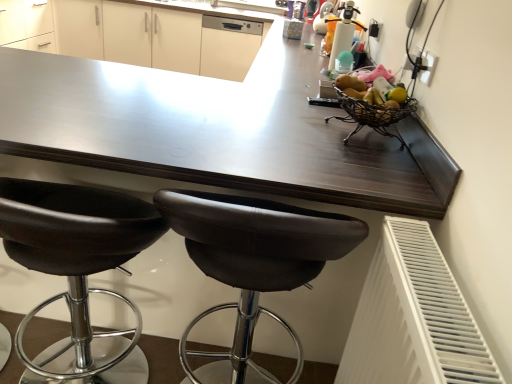
How much space does black leather stool at lower left, arranged as the first chair when viewed from the left, occupy vertically?

The height of black leather stool at lower left, arranged as the first chair when viewed from the left, is 84.64 centimeters.

Measure the distance between point (103, 55) and camera.

4.43 meters.

Where is `white matte cabinet at upper center`? The image size is (512, 384). white matte cabinet at upper center is located at coordinates (132, 35).

The width and height of the screenshot is (512, 384). What do you see at coordinates (428, 67) in the screenshot?
I see `black plastic socket at upper right` at bounding box center [428, 67].

Image resolution: width=512 pixels, height=384 pixels. In order to click on white glossy dishwasher at upper center in this screenshot , I will do click(228, 47).

I want to click on brown leather stool at center, which ranks as the first chair in right-to-left order, so click(253, 265).

I want to click on white plastic radiator at lower right, so click(413, 317).

Considering the relative positions of black plastic socket at upper right and black leather stool at lower left, the second chair viewed from the right, in the image provided, is black plastic socket at upper right behind black leather stool at lower left, the second chair viewed from the right,?

Yes, black plastic socket at upper right is further from the viewer.

I want to click on the 1st chair in front of the black plastic socket at upper right, starting your count from the anchor, so click(78, 271).

What's the angular difference between black plastic socket at upper right and black leather stool at lower left, arranged as the first chair when viewed from the left,'s facing directions?

The facing directions of black plastic socket at upper right and black leather stool at lower left, arranged as the first chair when viewed from the left, are 92.1 degrees apart.

How different are the orientations of white glossy dishwasher at upper center and white plastic radiator at lower right in degrees?

There is a 91-degree angle between the facing directions of white glossy dishwasher at upper center and white plastic radiator at lower right.

Considering the positions of points (256, 29) and (418, 301), is point (256, 29) closer to camera compared to point (418, 301)?

No, it is not.

Could you measure the distance between white glossy dishwasher at upper center and white plastic radiator at lower right?

white glossy dishwasher at upper center and white plastic radiator at lower right are 3.70 meters apart.

Considering the sizes of objects white glossy dishwasher at upper center and white plastic radiator at lower right in the image provided, who is thinner, white glossy dishwasher at upper center or white plastic radiator at lower right?

With smaller width is white plastic radiator at lower right.

Consider the image. Can you confirm if white glossy dishwasher at upper center is positioned to the left of brown leather stool at center, which is the second chair in left-to-right order?

Yes.

Which is in front, point (217, 54) or point (218, 197)?

The point (218, 197) is in front.

From the image's perspective, between white glossy dishwasher at upper center and brown leather stool at center, which is the second chair in left-to-right order, which one is located above?

white glossy dishwasher at upper center is shown above in the image.

Based on the photo, is brown leather stool at center, which is the second chair in left-to-right order, at the back of white glossy dishwasher at upper center?

No.

From the image's perspective, is brown leather stool at center, which is the second chair in left-to-right order, located beneath black leather stool at lower left, the second chair viewed from the right?

Yes.

Is brown leather stool at center, which is the second chair in left-to-right order, turned away from black leather stool at lower left, arranged as the first chair when viewed from the left?

brown leather stool at center, which is the second chair in left-to-right order, does not have its back to black leather stool at lower left, arranged as the first chair when viewed from the left.

Locate an element on the screen. chair behind the brown leather stool at center, which ranks as the first chair in right-to-left order is located at coordinates (78, 271).

Is brown leather stool at center, which ranks as the first chair in right-to-left order, a part of black leather stool at lower left, the second chair viewed from the right?

No, brown leather stool at center, which ranks as the first chair in right-to-left order, is not inside black leather stool at lower left, the second chair viewed from the right.

Which is closer to the camera, (81,354) or (210,210)?

The point (210,210) is closer.

Is black leather stool at lower left, the second chair viewed from the right, beside brown leather stool at center, which is the second chair in left-to-right order?

No, black leather stool at lower left, the second chair viewed from the right, is not making contact with brown leather stool at center, which is the second chair in left-to-right order.

Considering the relative sizes of black leather stool at lower left, arranged as the first chair when viewed from the left, and brown leather stool at center, which ranks as the first chair in right-to-left order, in the image provided, is black leather stool at lower left, arranged as the first chair when viewed from the left, shorter than brown leather stool at center, which ranks as the first chair in right-to-left order,?

Yes.

Between white glossy dishwasher at upper center and black leather stool at lower left, the second chair viewed from the right, which one has less height?

white glossy dishwasher at upper center is shorter.

Does white glossy dishwasher at upper center come in front of black leather stool at lower left, arranged as the first chair when viewed from the left?

No, it is not.

Which is farther, (x=238, y=61) or (x=1, y=179)?

The point (x=238, y=61) is farther from the camera.

Could you tell me if white glossy dishwasher at upper center is turned towards black leather stool at lower left, arranged as the first chair when viewed from the left?

Yes, white glossy dishwasher at upper center is aimed at black leather stool at lower left, arranged as the first chair when viewed from the left.

From a real-world perspective, is white matte cabinet at upper center located beneath white plastic radiator at lower right?

Yes, from a real-world perspective, white matte cabinet at upper center is beneath white plastic radiator at lower right.

Between point (149, 19) and point (364, 339), which one is positioned behind?

The point (149, 19) is behind.

Is white matte cabinet at upper center next to white plastic radiator at lower right and touching it?

No, white matte cabinet at upper center is not in contact with white plastic radiator at lower right.

From the image's perspective, is white matte cabinet at upper center on white plastic radiator at lower right?

Yes.

Image resolution: width=512 pixels, height=384 pixels. I want to click on chair that is the 2nd object directly below the black plastic socket at upper right (from a real-world perspective), so click(x=78, y=271).

In order to click on radiator located in front of the white glossy dishwasher at upper center in this screenshot , I will do `click(413, 317)`.

Considering their positions, is white matte cabinet at upper center positioned further to white plastic radiator at lower right than brown leather stool at center, which is the second chair in left-to-right order?

white matte cabinet at upper center.

Which object lies further to the anchor point white glossy dishwasher at upper center, white matte cabinet at upper center or black leather stool at lower left, arranged as the first chair when viewed from the left?

black leather stool at lower left, arranged as the first chair when viewed from the left, is further to white glossy dishwasher at upper center.

Based on their spatial positions, is black plastic socket at upper right or white plastic radiator at lower right further from black leather stool at lower left, arranged as the first chair when viewed from the left?

black plastic socket at upper right is positioned further to the anchor black leather stool at lower left, arranged as the first chair when viewed from the left.

In the scene shown: Estimate the real-world distances between objects in this image. Which object is closer to brown leather stool at center, which is the second chair in left-to-right order, black plastic socket at upper right or white matte cabinet at upper center?

Based on the image, black plastic socket at upper right appears to be nearer to brown leather stool at center, which is the second chair in left-to-right order.

Looking at the image, which one is located further to black leather stool at lower left, arranged as the first chair when viewed from the left, white matte cabinet at upper center or black plastic socket at upper right?

Among the two, white matte cabinet at upper center is located further to black leather stool at lower left, arranged as the first chair when viewed from the left.

Which object lies further to the anchor point black leather stool at lower left, the second chair viewed from the right, white glossy dishwasher at upper center or black plastic socket at upper right?

white glossy dishwasher at upper center.

Consider the image. Looking at the image, which one is located further to brown leather stool at center, which is the second chair in left-to-right order, white matte cabinet at upper center or white glossy dishwasher at upper center?

Based on the image, white matte cabinet at upper center appears to be further to brown leather stool at center, which is the second chair in left-to-right order.

Looking at the image, which one is located further to black plastic socket at upper right, black leather stool at lower left, arranged as the first chair when viewed from the left, or white matte cabinet at upper center?

white matte cabinet at upper center is further to black plastic socket at upper right.

Find the location of a particular element. This screenshot has height=384, width=512. chair located between brown leather stool at center, which ranks as the first chair in right-to-left order, and white glossy dishwasher at upper center in the depth direction is located at coordinates (78, 271).

Locate an element on the screen. The width and height of the screenshot is (512, 384). chair between brown leather stool at center, which ranks as the first chair in right-to-left order, and white matte cabinet at upper center from front to back is located at coordinates (78, 271).

Locate an element on the screen. The width and height of the screenshot is (512, 384). chair situated between black leather stool at lower left, arranged as the first chair when viewed from the left, and black plastic socket at upper right from left to right is located at coordinates (253, 265).

I want to click on electric outlet between brown leather stool at center, which ranks as the first chair in right-to-left order, and white glossy dishwasher at upper center in the front-back direction, so click(428, 67).